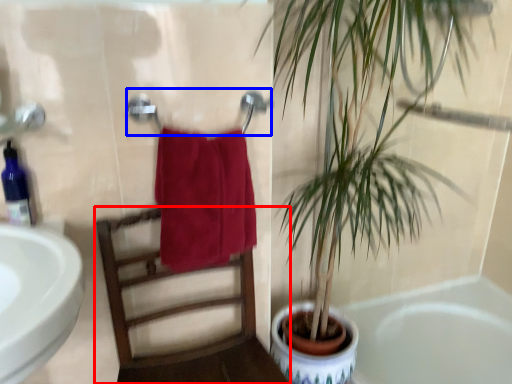
Question: Among these objects, which one is nearest to the camera, chair (highlighted by a red box) or towel bar (highlighted by a blue box)?

Choices:
 (A) chair
 (B) towel bar

Answer: (A)